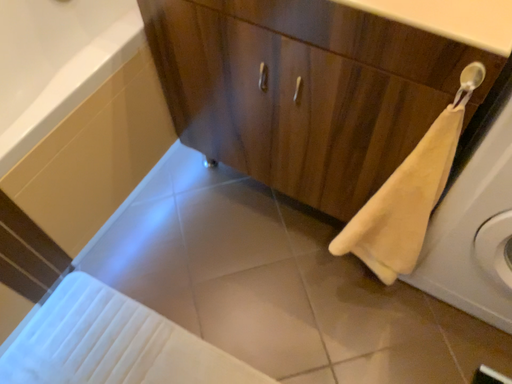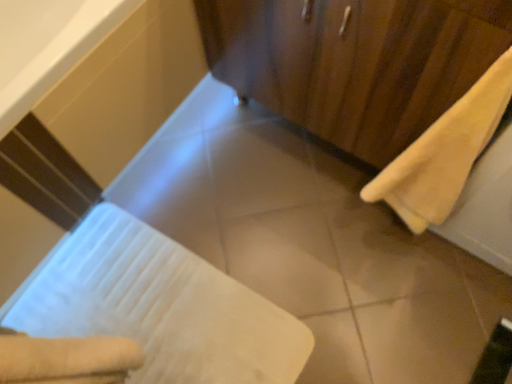
Question: How did the camera likely rotate when shooting the video?

Choices:
 (A) rotated upward
 (B) rotated downward

Answer: (B)